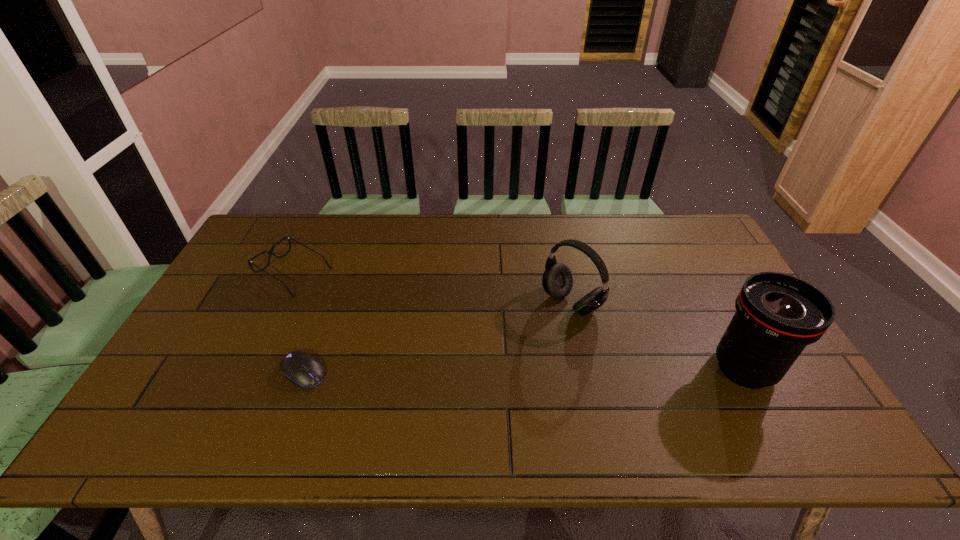
Identify the location of free space located on the ear cups of the headset. The width and height of the screenshot is (960, 540). (475, 378).

Where is `free space located 0.230m on the ear cups of the headset`? free space located 0.230m on the ear cups of the headset is located at coordinates (494, 362).

I want to click on vacant region located 0.220m on the ear cups of the headset, so click(x=497, y=360).

Where is `object that is at the far edge`? object that is at the far edge is located at coordinates (270, 251).

This screenshot has height=540, width=960. Find the location of `computer mouse located at the near edge`. computer mouse located at the near edge is located at coordinates (301, 368).

You are a GUI agent. You are given a task and a screenshot of the screen. Output one action in this format:
    pyautogui.click(x=<x>, y=<y>)
    Task: Click on the telephoto lens positioned at the near edge
    This screenshot has height=540, width=960.
    Given the screenshot: What is the action you would take?
    pyautogui.click(x=777, y=315)

The height and width of the screenshot is (540, 960). What are the coordinates of `object that is at the left edge` in the screenshot? It's located at (270, 251).

I want to click on object that is at the right edge, so click(x=777, y=315).

You are a GUI agent. You are given a task and a screenshot of the screen. Output one action in this format:
    pyautogui.click(x=<x>, y=<y>)
    Task: Click on the object present at the far left corner
    Image resolution: width=960 pixels, height=540 pixels.
    Given the screenshot: What is the action you would take?
    pyautogui.click(x=270, y=251)

What are the coordinates of `object located at the near right corner` in the screenshot? It's located at (777, 315).